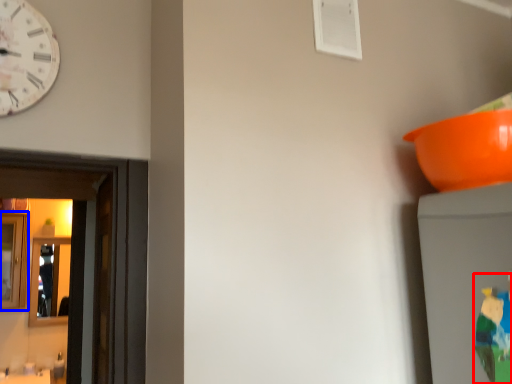
Question: Which object is further to the camera taking this photo, toy (highlighted by a red box) or mirror (highlighted by a blue box)?

Choices:
 (A) toy
 (B) mirror

Answer: (B)